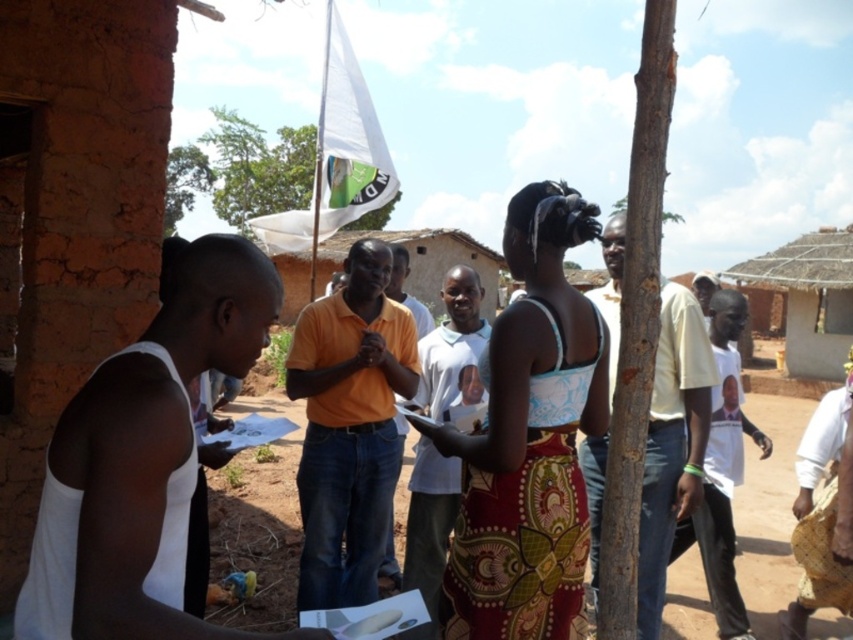
You are a photographer trying to capture a group photo of the scene. The printed fabric dress at center and the white fabric flag at upper center are both in the frame. Which object is wider in the photo?

The white fabric flag at upper center is wider than the printed fabric dress at center.

You are standing at the origin point of the coordinate system in the image. The printed fabric dress at center is at point (529,440). If you want to walk towards the printed fabric dress at center, in which direction should you move?

You should move in the direction of the point (529,440) to reach the printed fabric dress at center.

You are a photographer trying to capture a photo of the printed fabric dress at center and the white fabric flag at upper center. Which object should you focus on first if you want to ensure both are in frame without moving the camera?

You should focus on the printed fabric dress at center first because it is shorter than the white fabric flag at upper center, so it will be easier to frame both without moving the camera.